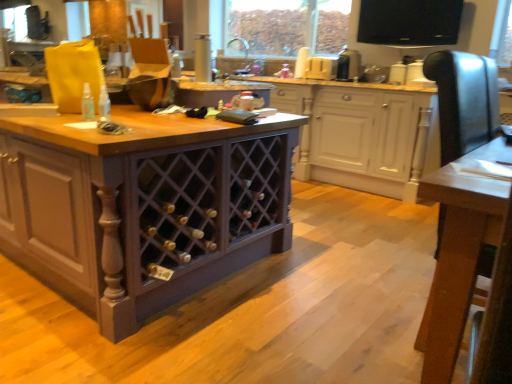
Question: In terms of size, does purple wood wine rack at center, the 1th cabinetry when ordered from front to back, appear bigger or smaller than black plastic toaster at upper center?

Choices:
 (A) big
 (B) small

Answer: (A)

Question: Considering the positions of purple wood wine rack at center, the 1th cabinetry when ordered from front to back, and black plastic toaster at upper center in the image, is purple wood wine rack at center, the 1th cabinetry when ordered from front to back, wider or thinner than black plastic toaster at upper center?

Choices:
 (A) wide
 (B) thin

Answer: (A)

Question: Based on their relative distances, which object is farther from the wooden table at center?

Choices:
 (A) purple wood wine rack at center, the 1th cabinetry when ordered from front to back
 (B) black plastic toaster at upper center
 (C) purple wood wine rack at center, the second cabinetry positioned from the front
 (D) translucent plastic spray bottle at center

Answer: (B)

Question: Estimate the real-world distances between objects in this image. Which object is farther from the translucent plastic spray bottle at center?

Choices:
 (A) purple wood wine rack at center, which appears as the second cabinetry when viewed from the back
 (B) wooden table at center
 (C) black plastic toaster at upper center
 (D) purple wood wine rack at center, the 1th cabinetry viewed from the back

Answer: (C)